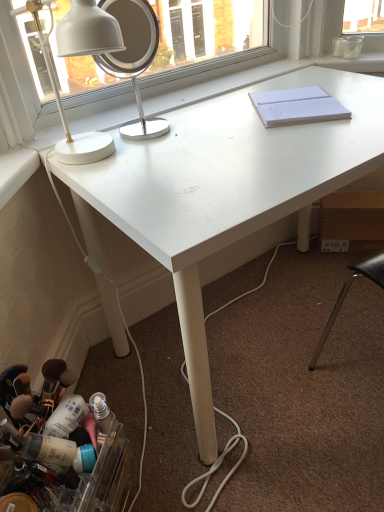
Where is `free space in front of white metallic mirror at upper left`? The height and width of the screenshot is (512, 384). free space in front of white metallic mirror at upper left is located at coordinates (163, 158).